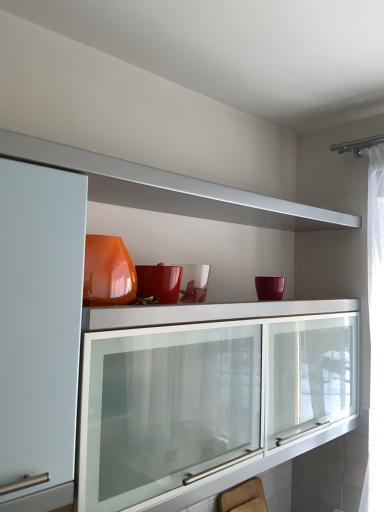
Where is `wooden swivel chair at lower center`? The width and height of the screenshot is (384, 512). wooden swivel chair at lower center is located at coordinates (244, 497).

The width and height of the screenshot is (384, 512). What do you see at coordinates (244, 497) in the screenshot? I see `wooden swivel chair at lower center` at bounding box center [244, 497].

In order to face wooden swivel chair at lower center, should I rotate leftwards or rightwards?

To face it directly, rotate right by 9.042 degrees.

I want to click on matte orange vase at upper center, so click(176, 209).

Measure the distance between point (129, 200) and camera.

Point (129, 200) is 4.32 feet from camera.

What do you see at coordinates (176, 209) in the screenshot?
I see `matte orange vase at upper center` at bounding box center [176, 209].

Locate an element on the screen. The height and width of the screenshot is (512, 384). wooden swivel chair at lower center is located at coordinates (x=244, y=497).

Which is more to the left, wooden swivel chair at lower center or matte orange vase at upper center?

Positioned to the left is matte orange vase at upper center.

Relative to matte orange vase at upper center, is wooden swivel chair at lower center in front or behind?

wooden swivel chair at lower center is behind matte orange vase at upper center.

Which is further, (249, 484) or (161, 195)?

The point (249, 484) is behind.

From the image's perspective, is wooden swivel chair at lower center on matte orange vase at upper center?

Actually, wooden swivel chair at lower center appears below matte orange vase at upper center in the image.

From a real-world perspective, is wooden swivel chair at lower center positioned under matte orange vase at upper center based on gravity?

Yes.

Is wooden swivel chair at lower center wider than matte orange vase at upper center?

In fact, wooden swivel chair at lower center might be narrower than matte orange vase at upper center.

Is wooden swivel chair at lower center taller or shorter than matte orange vase at upper center?

wooden swivel chair at lower center is shorter than matte orange vase at upper center.

Considering the relative sizes of wooden swivel chair at lower center and matte orange vase at upper center in the image provided, is wooden swivel chair at lower center smaller than matte orange vase at upper center?

Indeed, wooden swivel chair at lower center has a smaller size compared to matte orange vase at upper center.

Which is correct: wooden swivel chair at lower center is inside matte orange vase at upper center, or outside of it?

wooden swivel chair at lower center lies outside matte orange vase at upper center.

Based on the photo, are wooden swivel chair at lower center and matte orange vase at upper center located far from each other?

Actually, wooden swivel chair at lower center and matte orange vase at upper center are a little close together.

Is matte orange vase at upper center at the back of wooden swivel chair at lower center?

No, wooden swivel chair at lower center is not facing away from matte orange vase at upper center.

The width and height of the screenshot is (384, 512). Identify the location of cabinetry above the wooden swivel chair at lower center (from the image's perspective). click(176, 209).

Does matte orange vase at upper center appear on the right side of wooden swivel chair at lower center?

Incorrect, matte orange vase at upper center is not on the right side of wooden swivel chair at lower center.

Which object is closer to the camera, matte orange vase at upper center or wooden swivel chair at lower center?

Result: matte orange vase at upper center is in front.

Which is behind, point (79, 167) or point (252, 497)?

Point (252, 497)

From the image's perspective, who appears lower, matte orange vase at upper center or wooden swivel chair at lower center?

wooden swivel chair at lower center, from the image's perspective.

From a real-world perspective, who is located lower, matte orange vase at upper center or wooden swivel chair at lower center?

wooden swivel chair at lower center is physically lower.

Considering the relative sizes of matte orange vase at upper center and wooden swivel chair at lower center in the image provided, is matte orange vase at upper center wider than wooden swivel chair at lower center?

Yes.

Which of these two, matte orange vase at upper center or wooden swivel chair at lower center, stands shorter?

wooden swivel chair at lower center is shorter.

In terms of size, does matte orange vase at upper center appear bigger or smaller than wooden swivel chair at lower center?

In the image, matte orange vase at upper center appears to be larger than wooden swivel chair at lower center.

Is matte orange vase at upper center located outside wooden swivel chair at lower center?

matte orange vase at upper center is positioned outside wooden swivel chair at lower center.

Is there a large distance between matte orange vase at upper center and wooden swivel chair at lower center?

They are positioned close to each other.

Does matte orange vase at upper center turn towards wooden swivel chair at lower center?

No, matte orange vase at upper center is not oriented towards wooden swivel chair at lower center.

How many degrees apart are the facing directions of matte orange vase at upper center and wooden swivel chair at lower center?

0.0134 degrees.

Locate an element on the screen. swivel chair on the right of matte orange vase at upper center is located at coordinates (244, 497).

I want to click on swivel chair that is below the matte orange vase at upper center (from the image's perspective), so click(244, 497).

Where is `cabinetry located above the wooden swivel chair at lower center (from the image's perspective)`? cabinetry located above the wooden swivel chair at lower center (from the image's perspective) is located at coordinates (176, 209).